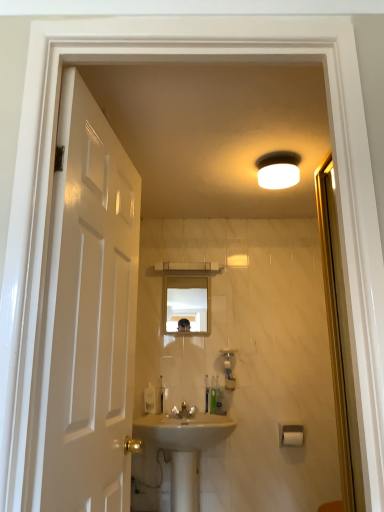
Question: Is white plastic toothbrush at center, the fifth toiletry in the right-to-left sequence, bigger or smaller than glossy white door at left?

Choices:
 (A) small
 (B) big

Answer: (A)

Question: From a real-world perspective, is white plastic toothbrush at center, the 1th toiletry viewed from the left, physically located above or below glossy white door at left?

Choices:
 (A) below
 (B) above

Answer: (A)

Question: Which object is the closest to the translucent plastic soap dispenser at center, the 3th toiletry positioned from the left?

Choices:
 (A) green plastic toothbrush at lower center, which is the 5th toiletry from left to right
 (B) translucent plastic toothbrush at center, which is the second toiletry from left to right
 (C) white plastic toothbrush at center, the fifth toiletry in the right-to-left sequence
 (D) beige ceramic sink at center
 (E) transparent glass screen door at right

Answer: (A)

Question: Estimate the real-world distances between objects in this image. Which object is closer to the white glossy faucet at center?

Choices:
 (A) white matte light fixture at upper center
 (B) beige ceramic sink at center
 (C) green plastic toothbrush at lower center, marked as the 1th toiletry in a right-to-left arrangement
 (D) translucent plastic toothbrush at center, the second toiletry positioned from the right
 (E) translucent plastic soap dispenser at center

Answer: (B)